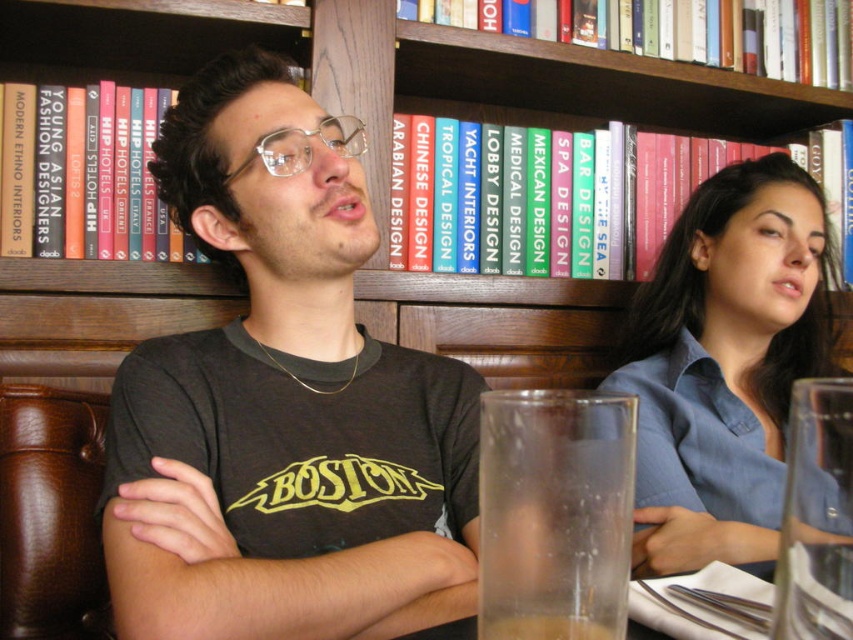
In the scene shown: You are a customer at the cafe and want to place your phone on the table. The table is rectangular and extends from coordinates 0.1 to 0.9 along the x and y axes. You want to place your phone at point (x=303, y=147). Is this point on the table?

Yes, the point (x=303, y=147) is on the clear plastic glasses at center, which are located on the table. Since the table extends from 0.1 to 0.9, the point is within the table area.